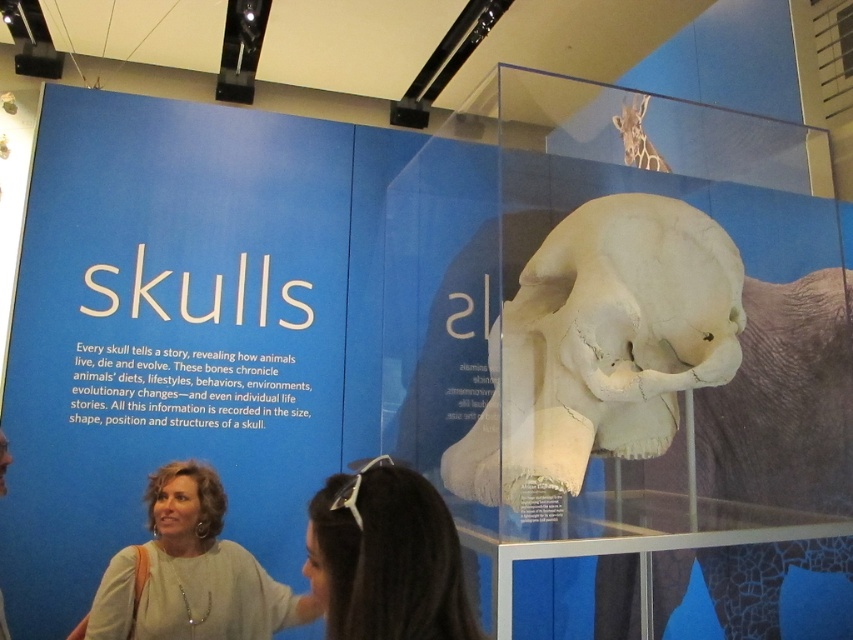
You are a visitor at the museum and you want to take a photo of both the white matte skull at center and the dark brown hair at lower center in the same frame. Based on their positions, which object should you focus on first to ensure both are in the frame?

The white matte skull at center is to the right of dark brown hair at lower center, so you should focus on the dark brown hair at lower center first to ensure both are in the frame.

You are a visitor at the museum and you want to take a photo of the white matte skull at center without the light beige sweater at lower left appearing in the shot. Is it possible to do so by adjusting your camera angle?

The white matte skull at center is much taller than the light beige sweater at lower left, so yes, you can adjust your camera angle to capture the white matte skull at center while excluding the light beige sweater at lower left from the frame.